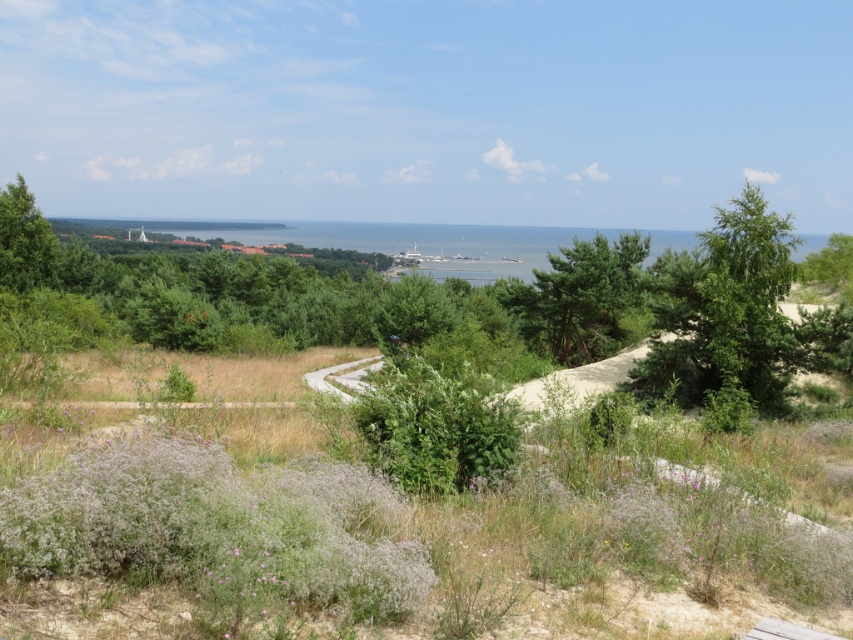
Does green leafy tree at right appear under green leafy tree at upper left?

Incorrect, green leafy tree at right is not positioned below green leafy tree at upper left.

Does green leafy tree at right appear on the left side of green leafy tree at upper left?

Incorrect, green leafy tree at right is not on the left side of green leafy tree at upper left.

What do you see at coordinates (723, 310) in the screenshot? I see `green leafy tree at right` at bounding box center [723, 310].

In order to click on green leafy tree at right in this screenshot , I will do `click(723, 310)`.

Can you confirm if green leafy tree at right is taller than green textured pine tree at center?

Yes.

Can you confirm if green leafy tree at right is bigger than green textured pine tree at center?

Correct, green leafy tree at right is larger in size than green textured pine tree at center.

Locate an element on the screen. green leafy tree at right is located at coordinates (723, 310).

Does green textured pine tree at center have a lesser width compared to green leafy tree at upper left?

Incorrect, green textured pine tree at center's width is not less than green leafy tree at upper left's.

Measure the distance between green textured pine tree at center and camera.

A distance of 119.90 feet exists between green textured pine tree at center and camera.

Find the location of a particular element. This screenshot has height=640, width=853. green textured pine tree at center is located at coordinates (579, 298).